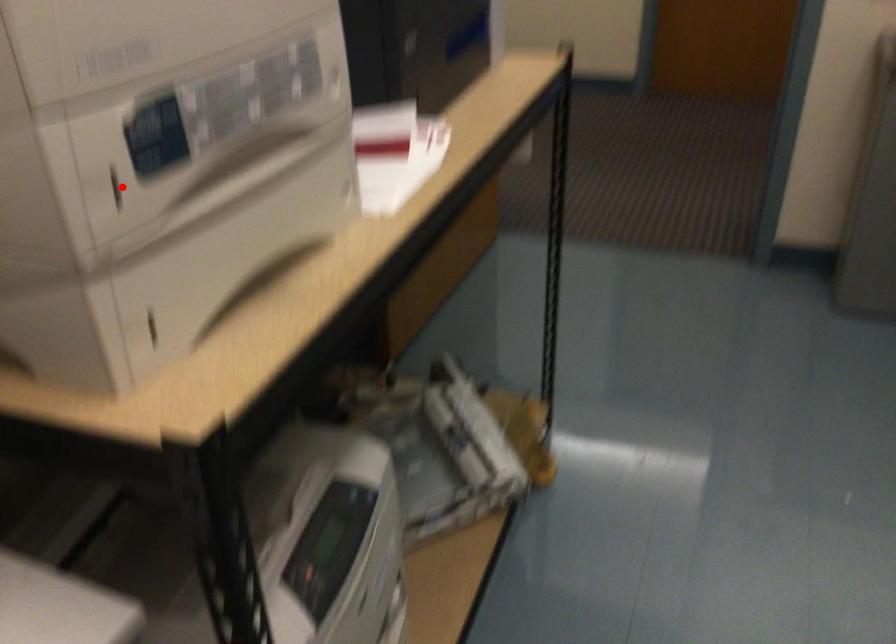
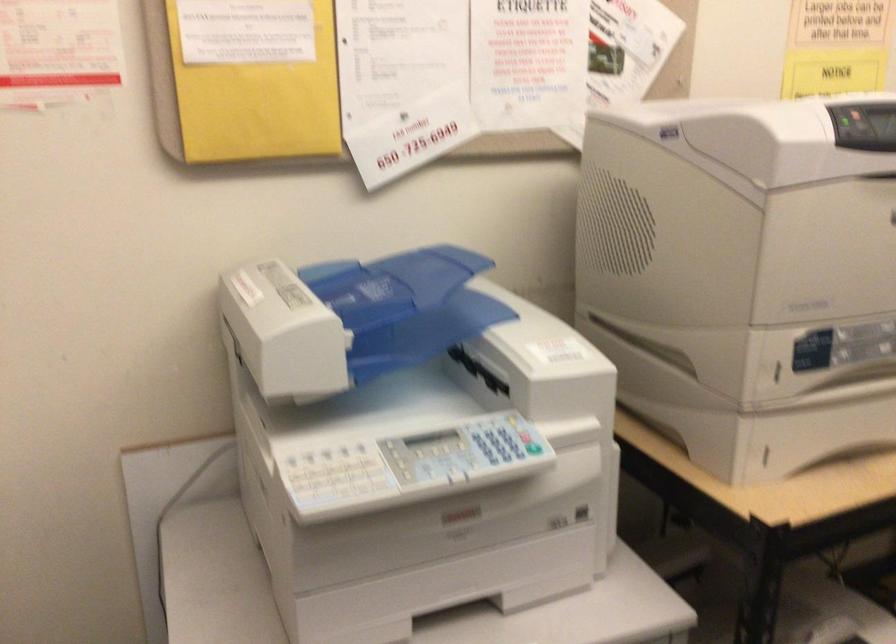
The point at the highlighted location is marked in the first image. Where is the corresponding point in the second image?

(777, 372)